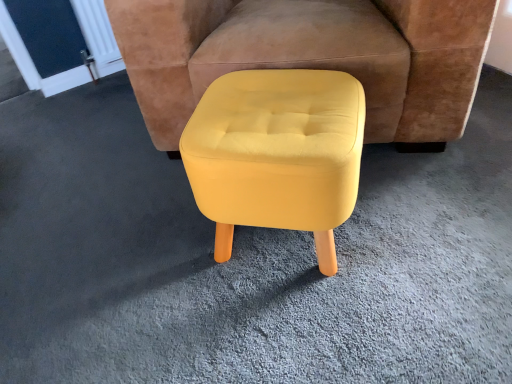
The height and width of the screenshot is (384, 512). Find the location of `vacant space to the left of yellow fabric ottoman at center`. vacant space to the left of yellow fabric ottoman at center is located at coordinates (73, 162).